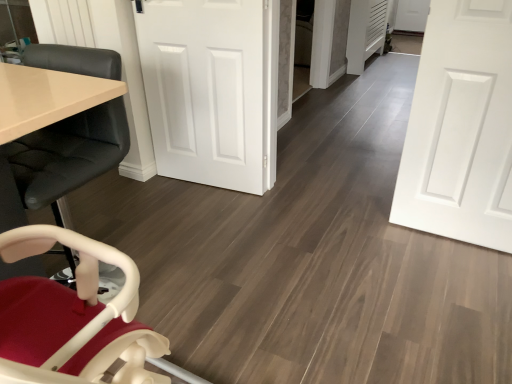
Image resolution: width=512 pixels, height=384 pixels. Identify the location of free space in front of white smooth door at center, acting as the first door starting from the left. (204, 222).